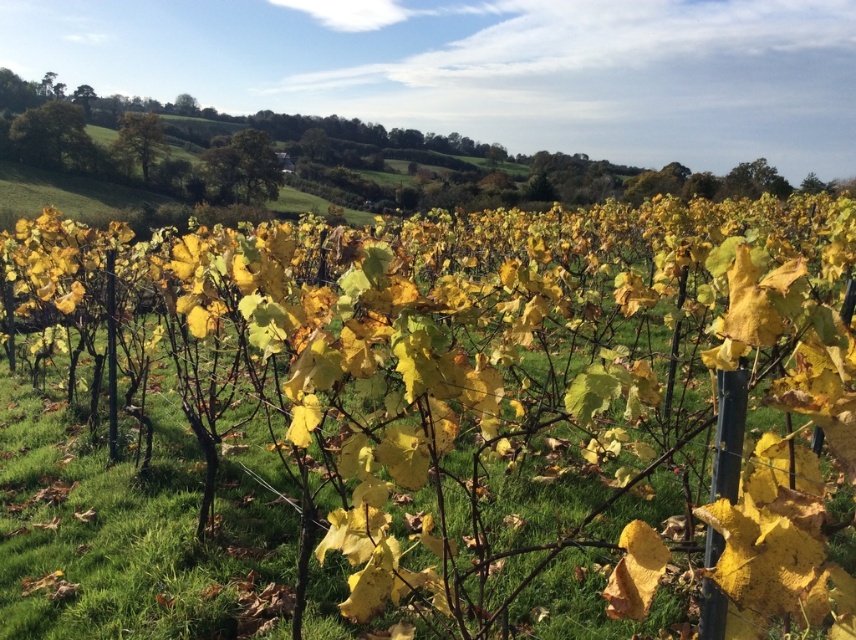
Question: Is green leafy tree at upper center positioned before golden-brown bark tree at upper left?

Choices:
 (A) no
 (B) yes

Answer: (B)

Question: Among these objects, which one is farthest from the camera?

Choices:
 (A) green leafy tree at upper right
 (B) green leafy tree at upper left
 (C) golden-brown bark tree at upper left
 (D) green leafy tree at upper center

Answer: (C)

Question: Does green leafy tree at upper left have a greater width compared to golden-brown bark tree at upper left?

Choices:
 (A) yes
 (B) no

Answer: (A)

Question: Where is green leafy tree at upper center located in relation to green leafy tree at upper right in the image?

Choices:
 (A) above
 (B) below

Answer: (A)

Question: Among these objects, which one is nearest to the camera?

Choices:
 (A) green leafy tree at upper left
 (B) green leafy tree at upper center

Answer: (B)

Question: Which of the following is the closest to the observer?

Choices:
 (A) green leafy tree at upper right
 (B) golden-brown bark tree at upper left

Answer: (A)